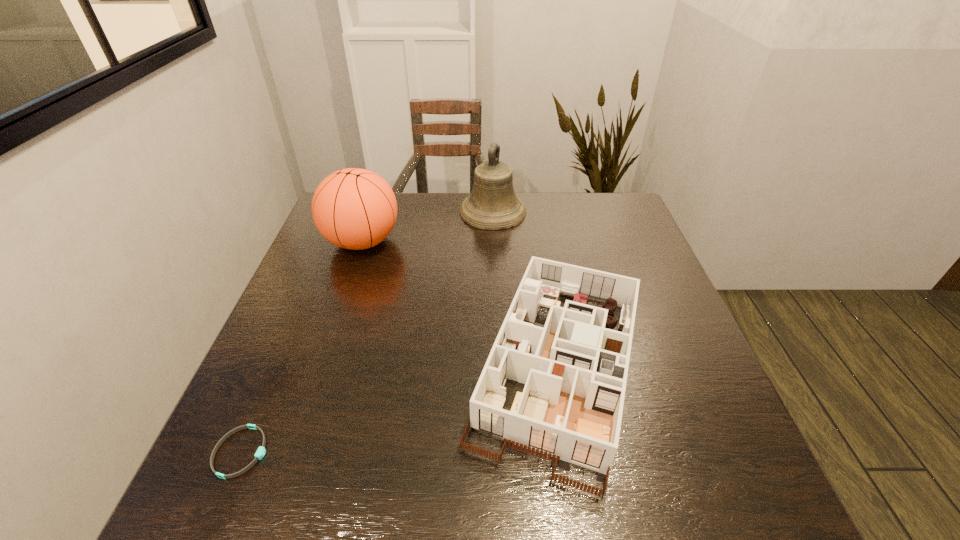
Identify the location of vacant space that's between the second shortest object and the basketball. (460, 305).

The image size is (960, 540). What are the coordinates of `blank region between the shortest object and the second shortest object` in the screenshot? It's located at (399, 410).

The height and width of the screenshot is (540, 960). Identify the location of empty space between the wristband and the basketball. 301,347.

Where is `object that is the nearest to the bell`? object that is the nearest to the bell is located at coordinates (353, 208).

Find the location of a particular element. The width and height of the screenshot is (960, 540). object that is the closest one to the basketball is located at coordinates (492, 205).

You are a GUI agent. You are given a task and a screenshot of the screen. Output one action in this format:
    pyautogui.click(x=<x>, y=<y>)
    Task: Click on the vacant space that satisfies the following two spatial constraints: 1. on the front side of the third tallest object; 2. on the left side of the bell
    The width and height of the screenshot is (960, 540).
    Given the screenshot: What is the action you would take?
    pyautogui.click(x=499, y=368)